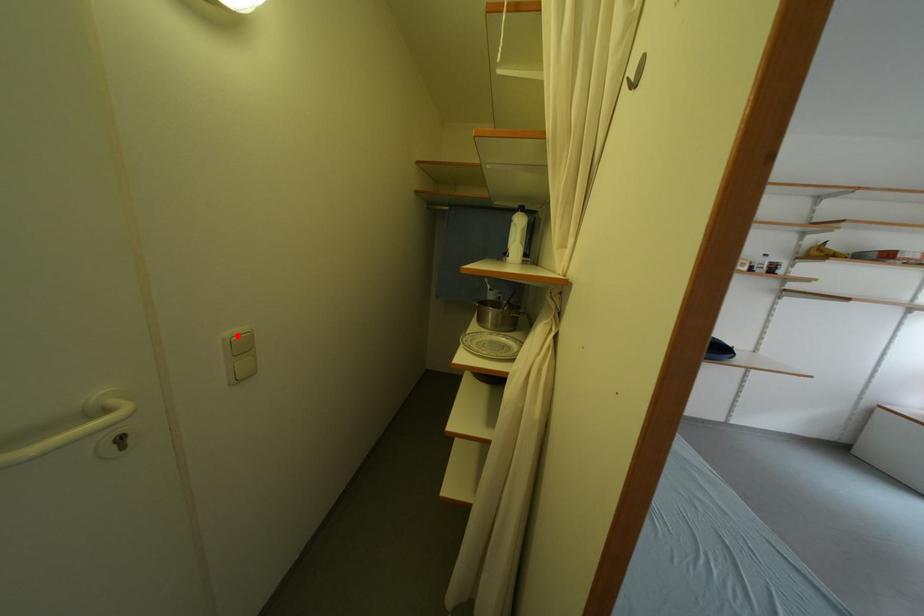
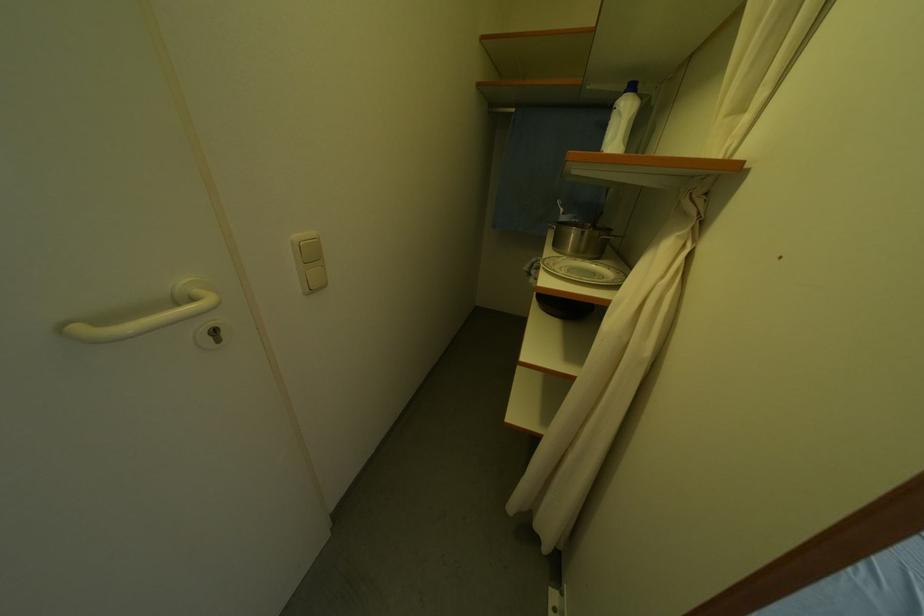
Find the pixel in the second image that matches the highlighted location in the first image.

(306, 238)